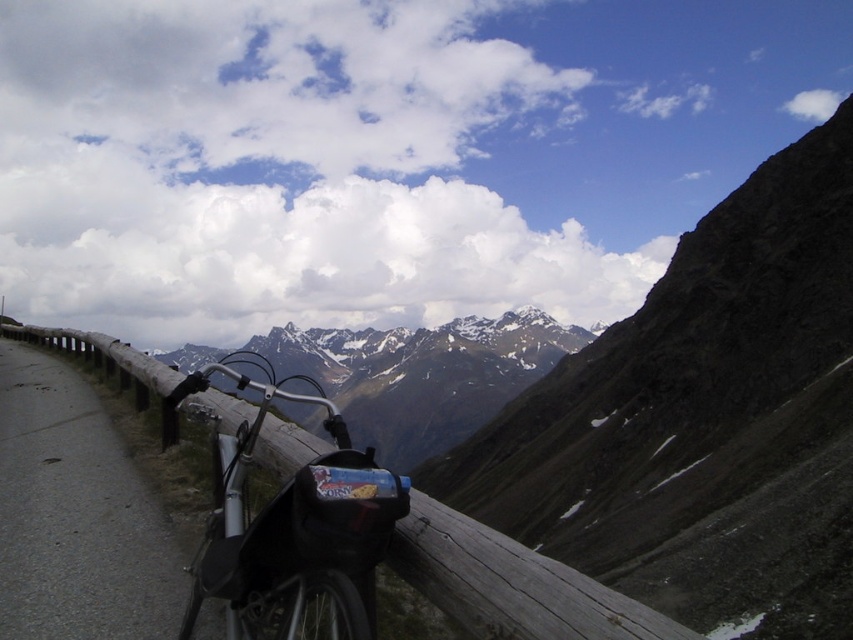
Question: Estimate the real-world distances between objects in this image. Which object is farther from the snowy rocky mountain range at center?

Choices:
 (A) shiny metallic bicycle at center
 (B) wooden at left
 (C) gray asphalt road at lower left

Answer: (C)

Question: Does gray asphalt road at lower left have a smaller size compared to wooden at left?

Choices:
 (A) yes
 (B) no

Answer: (A)

Question: Does shiny metallic bicycle at center have a greater width compared to snowy rocky mountain range at center?

Choices:
 (A) no
 (B) yes

Answer: (A)

Question: Is gray asphalt road at lower left positioned at the back of wooden at left?

Choices:
 (A) yes
 (B) no

Answer: (A)

Question: Which point appears farthest from the camera in this image?

Choices:
 (A) (30, 636)
 (B) (326, 461)
 (C) (486, 387)

Answer: (C)

Question: Which object is positioned farthest from the gray asphalt road at lower left?

Choices:
 (A) wooden at left
 (B) shiny metallic bicycle at center

Answer: (B)